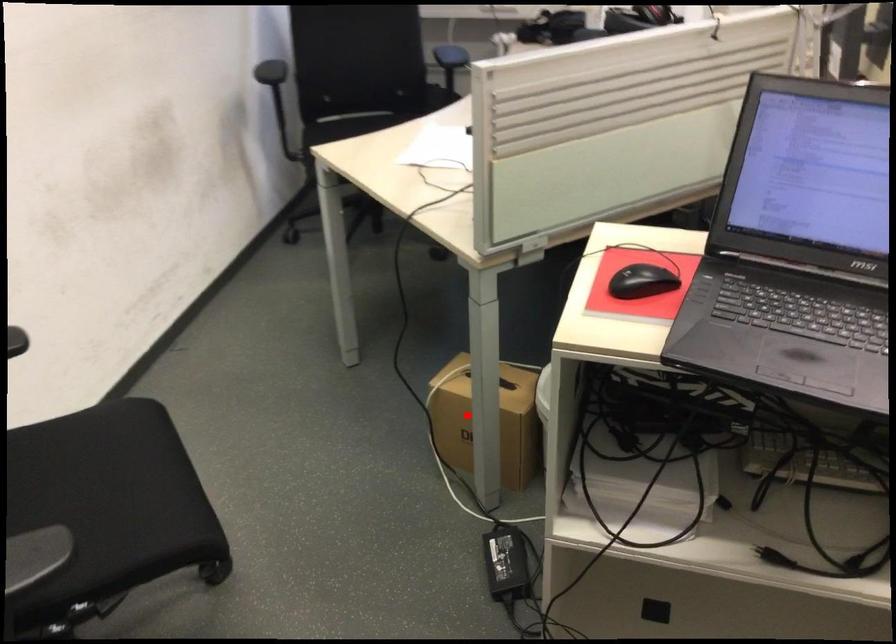
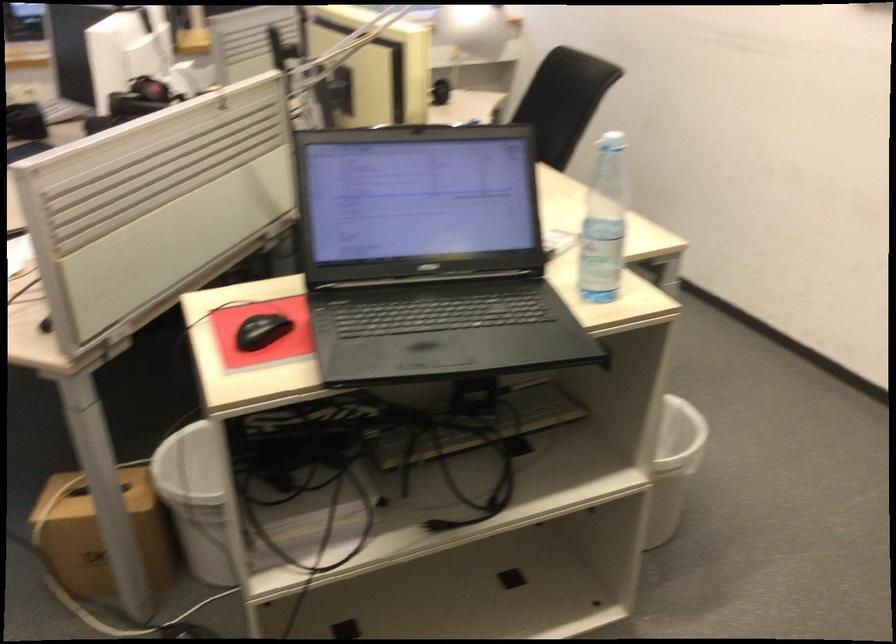
The point at the highlighted location is marked in the first image. Where is the corresponding point in the second image?

(100, 534)